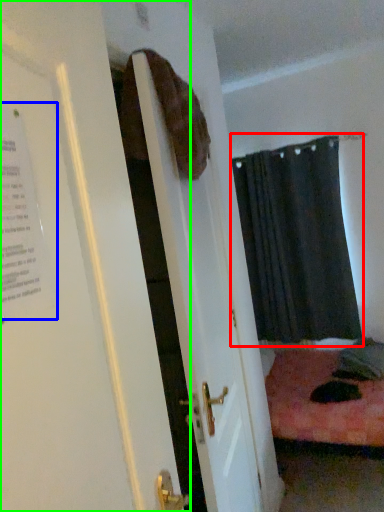
Question: Which object is the farthest from curtain (highlighted by a red box)? Choose among these: poster (highlighted by a blue box) or door (highlighted by a green box).

Choices:
 (A) poster
 (B) door

Answer: (A)